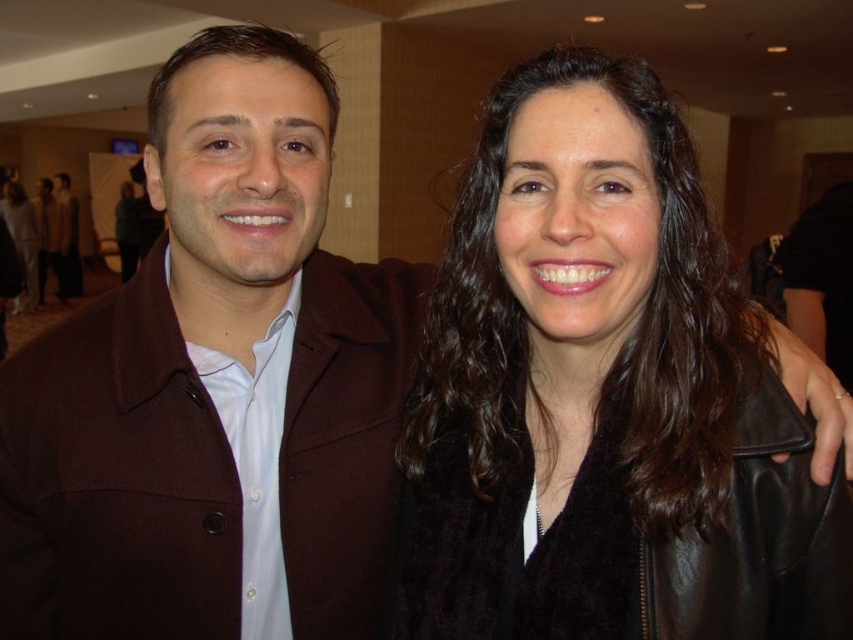
Question: Which point appears farthest from the camera in this image?

Choices:
 (A) (35, 253)
 (B) (376, 426)
 (C) (598, 448)

Answer: (A)

Question: Which of the following is the farthest from the observer?

Choices:
 (A) brown woolen coat at center
 (B) black leather jacket at center
 (C) matte brown coat at center

Answer: (C)

Question: Where is black leather jacket at center located in relation to brown woolen coat at center in the image?

Choices:
 (A) right
 (B) left

Answer: (A)

Question: Is black leather jacket at center positioned at the back of brown woolen coat at center?

Choices:
 (A) no
 (B) yes

Answer: (A)

Question: Which of these objects is positioned farthest from the matte brown coat at center?

Choices:
 (A) black leather jacket at center
 (B) brown woolen coat at center

Answer: (A)

Question: Does black leather jacket at center appear over matte brown coat at center?

Choices:
 (A) yes
 (B) no

Answer: (B)